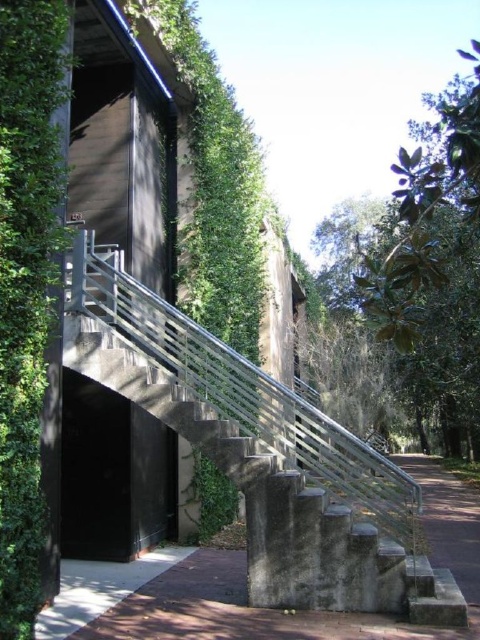
You are standing at the entrance of the modern building and notice two points marked on the structure. The first point is at coordinates point [262,600] and the second is at point [435,124]. Which of these two points is closer to you from your current position?

Point [262,600] is in front of point [435,124], so it is closer to you.